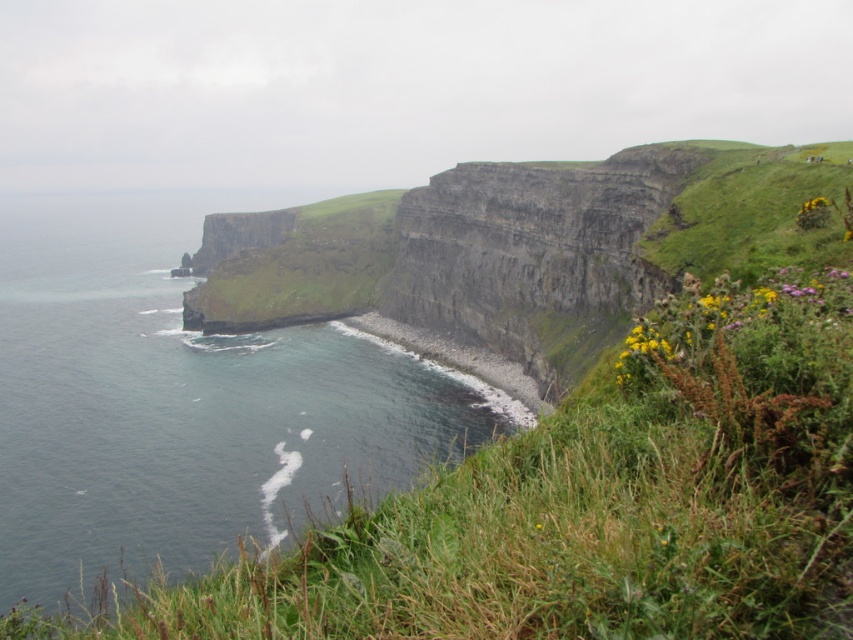
Which of these two, dark blue water at left or gray rocky shoreline at lower left, stands shorter?

gray rocky shoreline at lower left

Is dark blue water at left below gray rocky shoreline at lower left?

Actually, dark blue water at left is above gray rocky shoreline at lower left.

Which is behind, point (286, 353) or point (463, 378)?

Point (286, 353)

What are the coordinates of `dark blue water at left` in the screenshot? It's located at (184, 403).